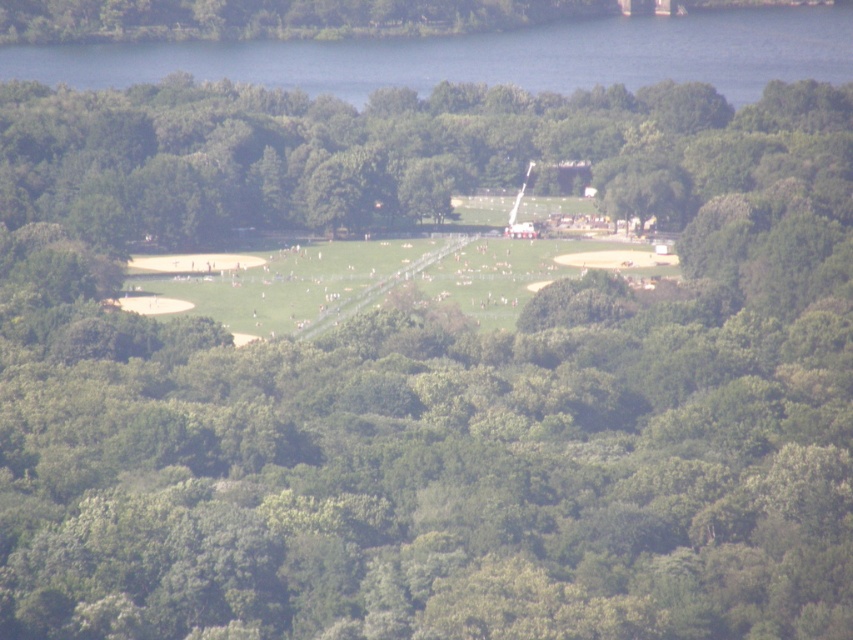
Measure the distance from blue water at upper center to green grassy field at center.

A distance of 116.13 feet exists between blue water at upper center and green grassy field at center.

Can you confirm if blue water at upper center is wider than green grassy field at center?

Yes.

Locate an element on the screen. Image resolution: width=853 pixels, height=640 pixels. blue water at upper center is located at coordinates (486, 58).

The height and width of the screenshot is (640, 853). Identify the location of blue water at upper center. (486, 58).